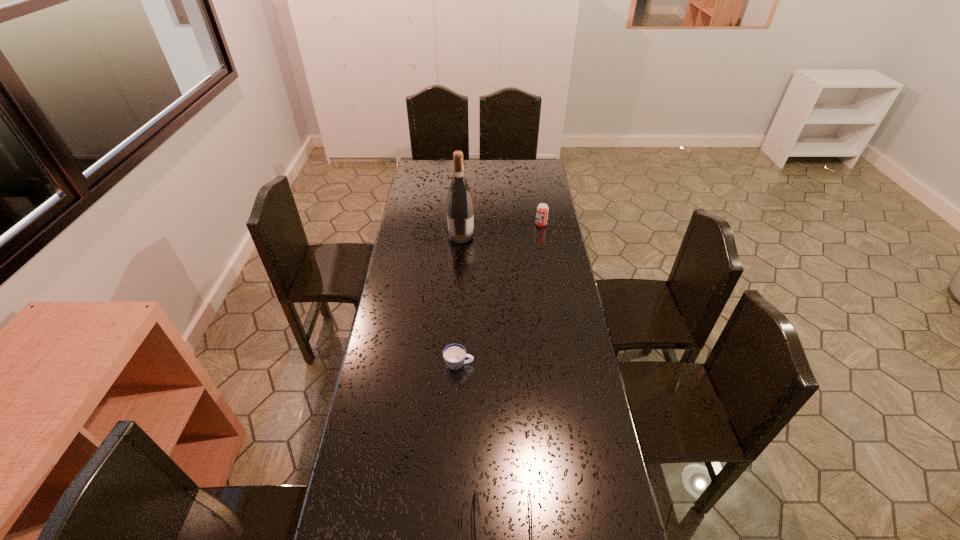
The height and width of the screenshot is (540, 960). I want to click on the tallest object, so click(460, 209).

Where is `wine bottle`? Image resolution: width=960 pixels, height=540 pixels. wine bottle is located at coordinates click(460, 209).

Locate an element on the screen. soda can is located at coordinates tap(542, 209).

I want to click on the farthest object, so click(x=542, y=209).

Image resolution: width=960 pixels, height=540 pixels. Identify the location of cup. (454, 355).

In order to click on the second nearest object in this screenshot , I will do `click(454, 355)`.

The height and width of the screenshot is (540, 960). In order to click on vacant space located 0.100m on the label of the tallest object in this screenshot , I will do `click(496, 235)`.

In order to click on free region located 0.270m on the back of the rightmost object in this screenshot , I will do `click(536, 191)`.

You are a GUI agent. You are given a task and a screenshot of the screen. Output one action in this format:
    pyautogui.click(x=<x>, y=<y>)
    Task: Click on the vacant area situated 0.390m on the side of the cup with the handle
    The height and width of the screenshot is (540, 960).
    Given the screenshot: What is the action you would take?
    pyautogui.click(x=588, y=364)

Identify the location of object present at the right edge. This screenshot has width=960, height=540. (542, 209).